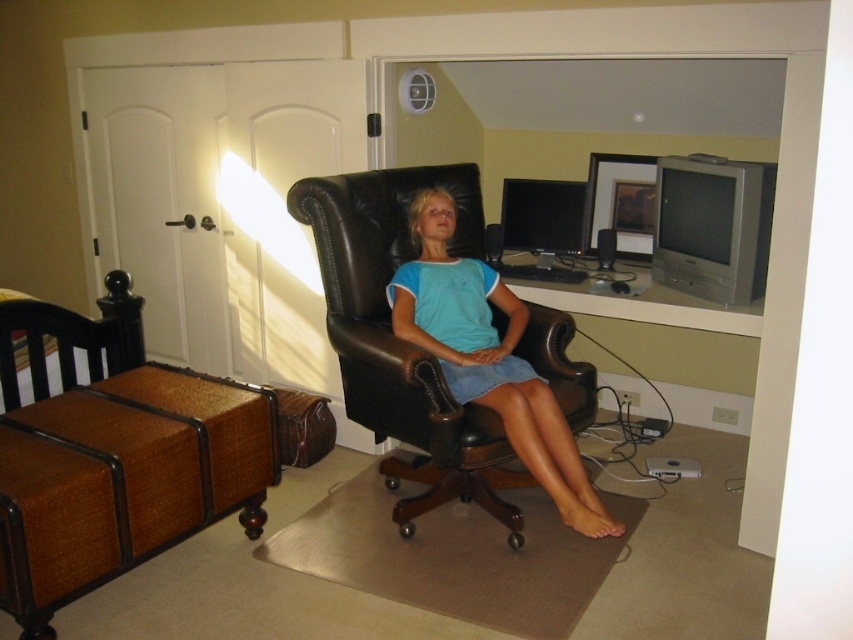
You are a tailor who needs to determine the correct size for a new garment. You observe the image and see the matte blue shirt at center and the silver metallic television at upper right. Which object has a greater height?

The matte blue shirt at center is taller than the silver metallic television at upper right, so the matte blue shirt at center has a greater height.

You are standing at the desk in the home office scene. You notice two points marked on the floor. The first point is at coordinates point (502, 396) and the second point is at point (675, 294). Which point is closer to you as you face the desk?

Point (502, 396) is in front of point (675, 294), so it is closer to you when facing the desk.